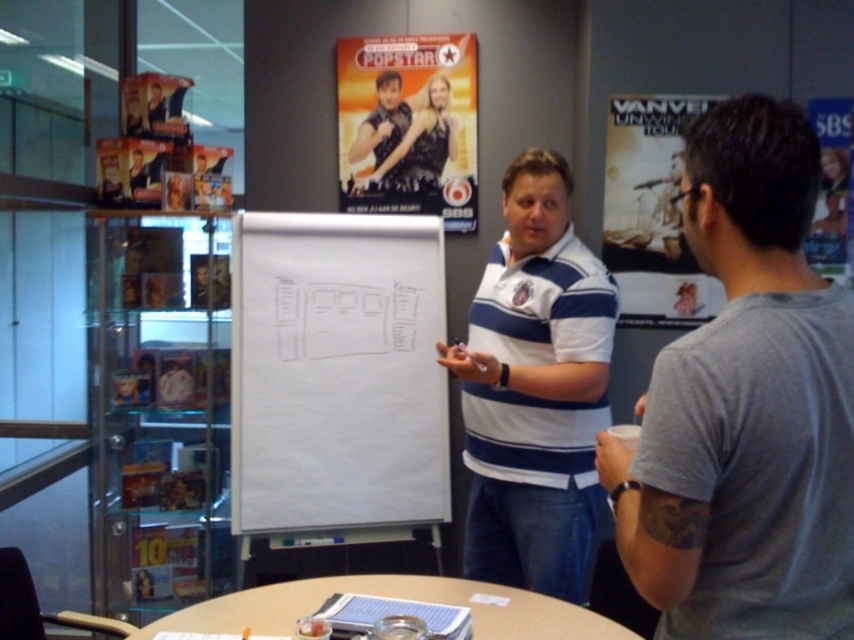
You are an office assistant who needs to hang a new poster that requires a taller space. Looking at the scene, which poster between the metallic glossy poster at upper center and the white paper poster at upper right would you choose to replace?

The white paper poster at upper right is taller than the metallic glossy poster at upper center, so you should choose to replace the white paper poster at upper right since it requires a taller space.

You are standing in the office scene and want to place a small sticker exactly halfway between the two points labeled point (723, 269) and point (541, 228). Will the sticker be closer to the flipchart or the person in the gray T shirt?

The sticker placed halfway between point (723, 269) and point (541, 228) will be closer to the flipchart because point (723, 269) is in front of point (541, 228), meaning the midpoint leans towards the flipchart side.